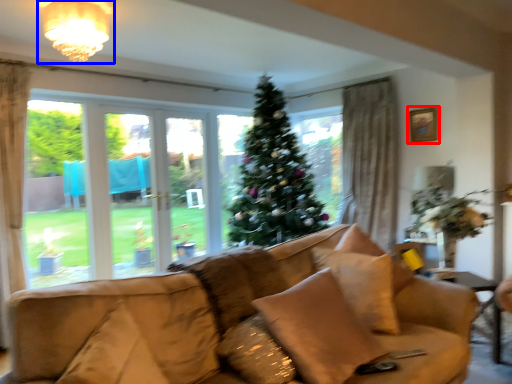
Question: Among these objects, which one is nearest to the camera, picture frame (highlighted by a red box) or light fixture (highlighted by a blue box)?

Choices:
 (A) picture frame
 (B) light fixture

Answer: (B)